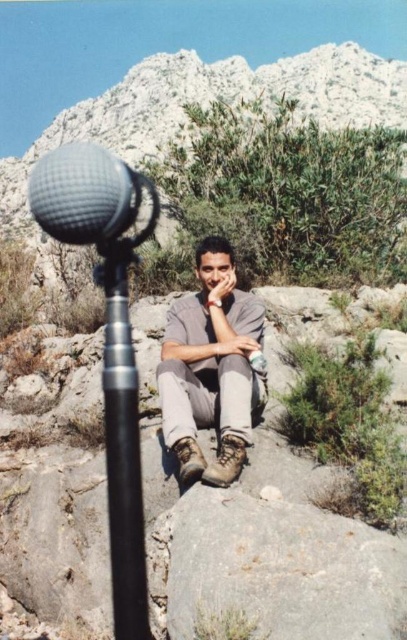
Question: Does black metallic pole at center appear over textured gray microphone at left?

Choices:
 (A) yes
 (B) no

Answer: (B)

Question: Where is gray matte shirt at center located in relation to black metallic pole at center in the image?

Choices:
 (A) right
 (B) left

Answer: (A)

Question: Which of the following is the farthest from the observer?

Choices:
 (A) (118, 161)
 (B) (192, 364)

Answer: (B)

Question: Which of the following is the farthest from the observer?

Choices:
 (A) (124, 369)
 (B) (148, 180)
 (C) (251, 428)

Answer: (B)

Question: Considering the real-world distances, which object is farthest from the black metallic pole at center?

Choices:
 (A) gray matte shirt at center
 (B) textured gray microphone at left

Answer: (B)

Question: Does black metallic pole at center have a smaller size compared to textured gray microphone at left?

Choices:
 (A) no
 (B) yes

Answer: (B)